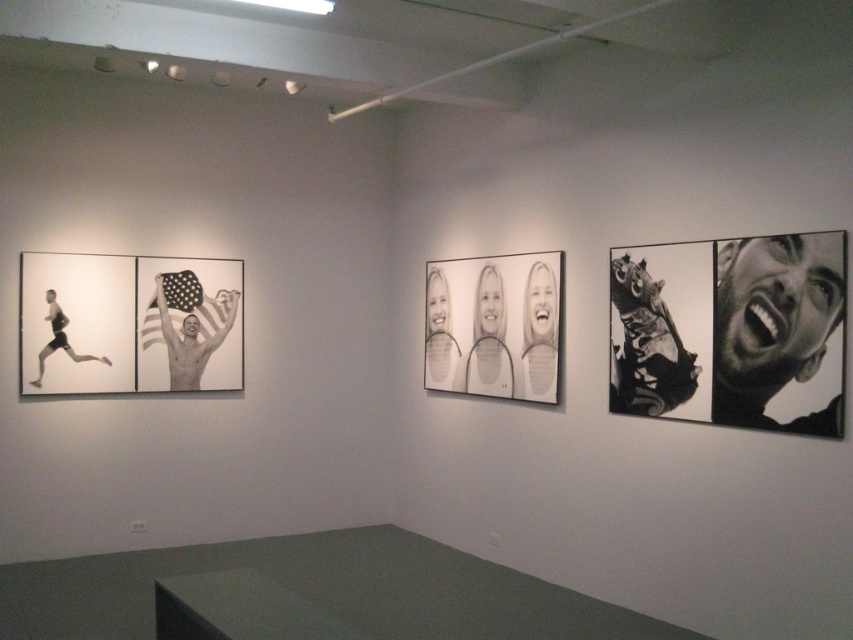
Question: Estimate the real-world distances between objects in this image. Which object is farther from the black and white photograph of three smiling faces at center?

Choices:
 (A) white matte tennis racket at center
 (B) black glossy tattoo at upper right

Answer: (B)

Question: Is black and white photograph of three smiling faces at center above white matte tennis racket at center?

Choices:
 (A) yes
 (B) no

Answer: (A)

Question: Among these objects, which one is farthest from the camera?

Choices:
 (A) white matte tennis racket at center
 (B) black and white photograph of three smiling faces at center

Answer: (A)

Question: Can you confirm if black and white photograph of three smiling faces at center is positioned above white matte tennis racket at center?

Choices:
 (A) yes
 (B) no

Answer: (A)

Question: Which object is the closest to the black glossy tattoo at upper right?

Choices:
 (A) black and white photograph of three smiling faces at center
 (B) white matte tennis racket at center

Answer: (A)

Question: Can you confirm if black and white photograph of three smiling faces at center is positioned to the left of white matte tennis racket at center?

Choices:
 (A) yes
 (B) no

Answer: (A)